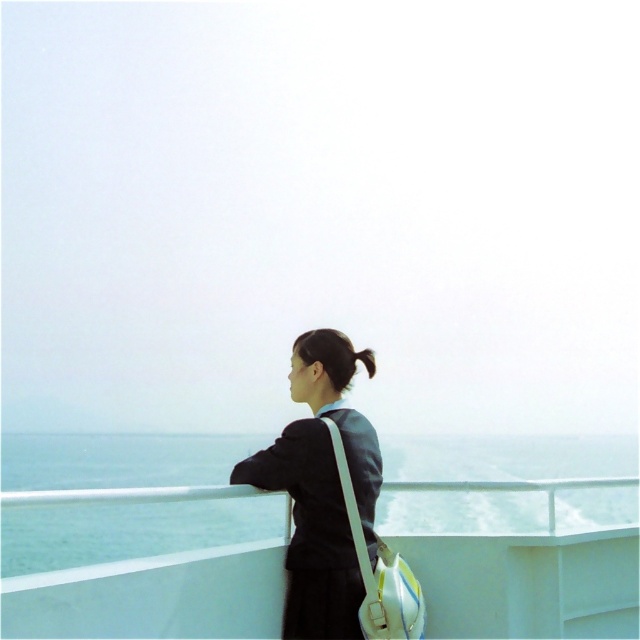
You are a photographer trying to capture the scene of the person on the deck. Since the blue water at center and the matte black jacket at center are both in your viewfinder, which one should you focus on to ensure it takes up more space in the photo?

The blue water at center is bigger than the matte black jacket at center, so focusing on the blue water at center will ensure it takes up more space in the photo.

You are navigating a small drone that needs to fly from point A to point B on the deck of the boat. Point A is at coordinates point (42, 532) and point B is at coordinates point (365, 358). According to the scene, which point is closer to the edge of the deck?

Point (42, 532) is behind point (365, 358), so point (365, 358) is closer to the edge of the deck.

You are a photographer trying to capture the person on the deck. To ensure the blue water at center and the black silky hair at upper center are both in the frame, which object should be positioned to the right side of the camera view?

The black silky hair at upper center should be positioned to the right side of the camera view because the blue water at center is to the left of the black silky hair at upper center.